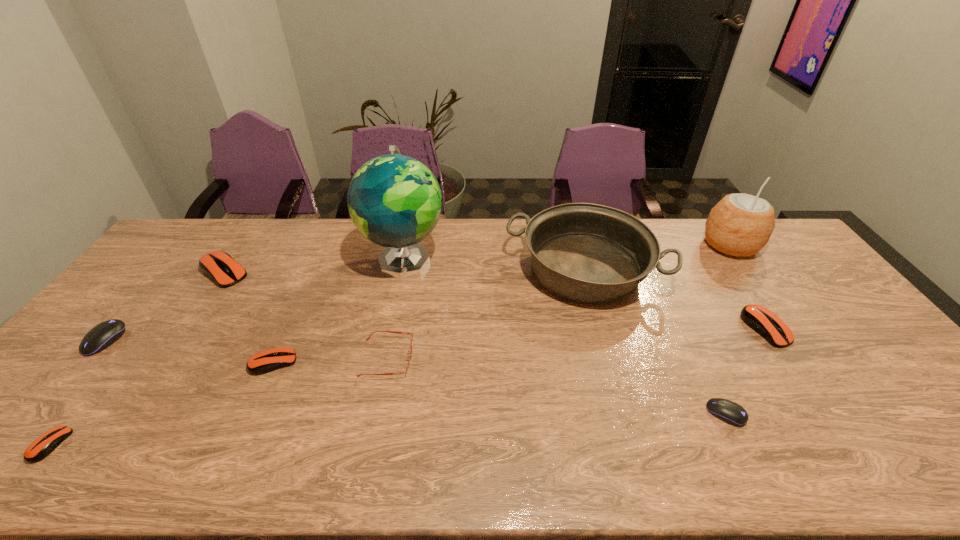
Select which object appears as the second closest to the third tallest object. Please provide its 2D coordinates. Your answer should be formatted as a tuple, i.e. [(x, y)], where the tuple contains the x and y coordinates of a point satisfying the conditions above.

[(740, 225)]

Identify which computer mouse is the fourth nearest to the nearest orange computer mouse. Please provide its 2D coordinates. Your answer should be formatted as a tuple, i.e. [(x, y)], where the tuple contains the x and y coordinates of a point satisfying the conditions above.

[(730, 412)]

Point out which computer mouse is positioned as the second nearest to the second object from left to right. Please provide its 2D coordinates. Your answer should be formatted as a tuple, i.e. [(x, y)], where the tuple contains the x and y coordinates of a point satisfying the conditions above.

[(266, 361)]

Where is `orange computer mouse that is the second nearest to the second tallest object`? The height and width of the screenshot is (540, 960). orange computer mouse that is the second nearest to the second tallest object is located at coordinates (266, 361).

Locate an element on the screen. orange computer mouse identified as the closest to the second computer mouse from left to right is located at coordinates (266, 361).

What are the coordinates of `blank space that satisfies the following two spatial constraints: 1. on the back side of the fifth computer mouse from left to right; 2. on the lenses of the spectacles` in the screenshot? It's located at (700, 357).

This screenshot has height=540, width=960. Identify the location of free point that satisfies the following two spatial constraints: 1. on the back side of the rightmost computer mouse; 2. on the left side of the smallest orange computer mouse. (141, 328).